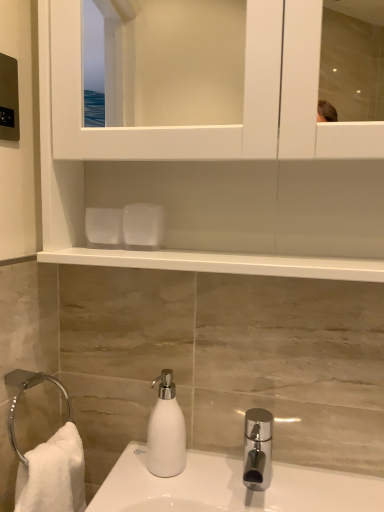
Locate an element on the screen. This screenshot has width=384, height=512. white matte cabinet at upper center is located at coordinates (216, 174).

The image size is (384, 512). What do you see at coordinates (216, 174) in the screenshot?
I see `white matte cabinet at upper center` at bounding box center [216, 174].

What is the approximate width of white matte soap dispenser at lower center?

It is 3.60 inches.

This screenshot has height=512, width=384. What do you see at coordinates (166, 431) in the screenshot? I see `white matte soap dispenser at lower center` at bounding box center [166, 431].

Image resolution: width=384 pixels, height=512 pixels. Identify the location of white matte soap dispenser at lower center. (166, 431).

This screenshot has width=384, height=512. In order to click on white matte cabinet at upper center in this screenshot , I will do `click(216, 174)`.

Between white matte soap dispenser at lower center and white matte cabinet at upper center, which one appears on the right side from the viewer's perspective?

white matte cabinet at upper center is more to the right.

Is white matte soap dispenser at lower center positioned before white matte cabinet at upper center?

No, it is not.

Is point (150, 445) closer or farther from the camera than point (249, 34)?

Clearly, point (150, 445) is more distant from the camera than point (249, 34).

From the image's perspective, is white matte soap dispenser at lower center under white matte cabinet at upper center?

Indeed, from the image's perspective, white matte soap dispenser at lower center is shown beneath white matte cabinet at upper center.

From a real-world perspective, which object rests below the other?

white matte soap dispenser at lower center is physically lower.

Considering the sizes of objects white matte soap dispenser at lower center and white matte cabinet at upper center in the image provided, who is wider, white matte soap dispenser at lower center or white matte cabinet at upper center?

Wider between the two is white matte cabinet at upper center.

Looking at this image, between white matte soap dispenser at lower center and white matte cabinet at upper center, which one has more height?

white matte cabinet at upper center is taller.

Between white matte soap dispenser at lower center and white matte cabinet at upper center, which one has smaller size?

With smaller size is white matte soap dispenser at lower center.

Does white matte soap dispenser at lower center contain white matte cabinet at upper center?

No, white matte cabinet at upper center is located outside of white matte soap dispenser at lower center.

Is there a large distance between white matte soap dispenser at lower center and white matte cabinet at upper center?

Actually, white matte soap dispenser at lower center and white matte cabinet at upper center are a little close together.

Consider the image. Is white matte cabinet at upper center at the back of white matte soap dispenser at lower center?

No, white matte soap dispenser at lower center's orientation is not away from white matte cabinet at upper center.

How many degrees apart are the facing directions of white matte soap dispenser at lower center and white matte cabinet at upper center?

There is a 1.19-degree angle between the facing directions of white matte soap dispenser at lower center and white matte cabinet at upper center.

Locate an element on the screen. The image size is (384, 512). soap dispenser that is on the left side of white matte cabinet at upper center is located at coordinates (166, 431).

Between white matte cabinet at upper center and white matte soap dispenser at lower center, which one appears on the right side from the viewer's perspective?

white matte cabinet at upper center is more to the right.

Is white matte cabinet at upper center further to camera compared to white matte soap dispenser at lower center?

No, it is in front of white matte soap dispenser at lower center.

Is point (286, 148) farther from camera compared to point (173, 465)?

That is False.

From the image's perspective, who appears lower, white matte cabinet at upper center or white matte soap dispenser at lower center?

white matte soap dispenser at lower center is shown below in the image.

In the scene shown: From a real-world perspective, is white matte cabinet at upper center physically below white matte soap dispenser at lower center?

No, from a real-world perspective, white matte cabinet at upper center is not beneath white matte soap dispenser at lower center.

Can you confirm if white matte cabinet at upper center is thinner than white matte soap dispenser at lower center?

No.

Which of these two, white matte cabinet at upper center or white matte soap dispenser at lower center, stands taller?

white matte cabinet at upper center.

Looking at the image, does white matte cabinet at upper center seem bigger or smaller compared to white matte soap dispenser at lower center?

Clearly, white matte cabinet at upper center is larger in size than white matte soap dispenser at lower center.

Is white matte cabinet at upper center inside the boundaries of white matte soap dispenser at lower center, or outside?

white matte cabinet at upper center is outside white matte soap dispenser at lower center.

Are white matte cabinet at upper center and white matte soap dispenser at lower center beside each other?

No, white matte cabinet at upper center is not making contact with white matte soap dispenser at lower center.

From the picture: Is white matte cabinet at upper center turned away from white matte soap dispenser at lower center?

That's not correct — white matte cabinet at upper center is not looking away from white matte soap dispenser at lower center.

Can you tell me how much white matte cabinet at upper center and white matte soap dispenser at lower center differ in facing direction?

white matte cabinet at upper center and white matte soap dispenser at lower center are facing 1.19 degrees away from each other.

Find the location of a particular element. This screenshot has height=512, width=384. soap dispenser below the white matte cabinet at upper center (from the image's perspective) is located at coordinates (166, 431).

At what (x,y) coordinates should I click in order to perform the action: click on cabinet in front of the white matte soap dispenser at lower center. Please return your answer as a coordinate pair (x, y). The height and width of the screenshot is (512, 384). Looking at the image, I should click on (216, 174).

Where is `soap dispenser lying on the left of white matte cabinet at upper center`? The image size is (384, 512). soap dispenser lying on the left of white matte cabinet at upper center is located at coordinates (166, 431).